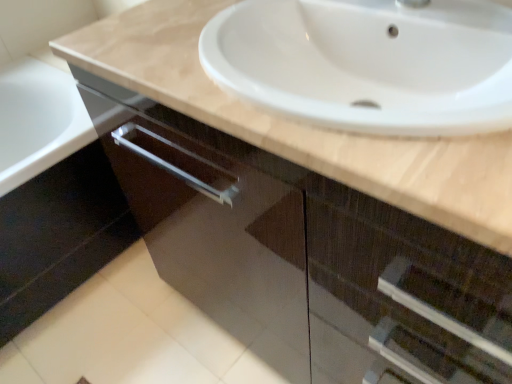
Locate an element on the screen. The height and width of the screenshot is (384, 512). empty space that is ontop of white glossy tile at lower left (from a real-world perspective) is located at coordinates (137, 334).